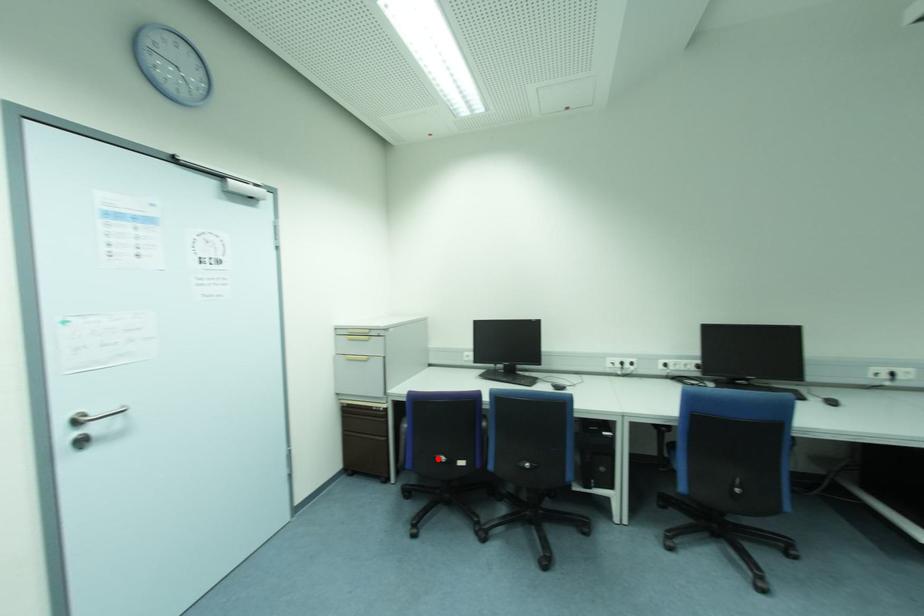
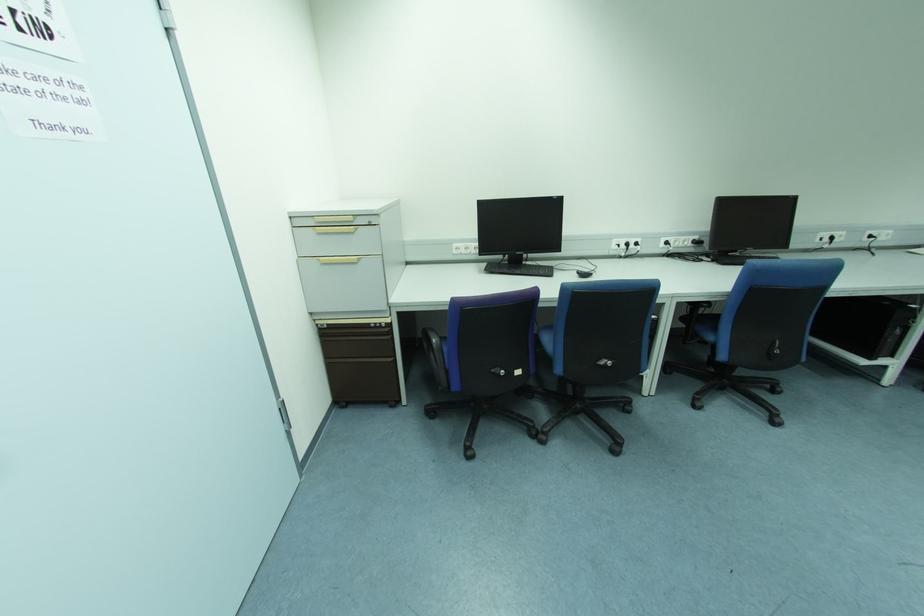
Where in the second image is the point corresponding to the highlighted location from the first image?

(494, 374)